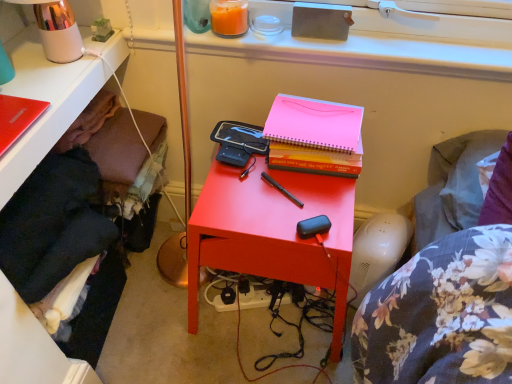
Identify the location of hardcover book at center. The width and height of the screenshot is (512, 384). (314, 123).

This screenshot has width=512, height=384. Describe the element at coordinates (52, 96) in the screenshot. I see `black fabric at lower left` at that location.

The height and width of the screenshot is (384, 512). Find the location of `black fabric at lower left`. black fabric at lower left is located at coordinates (52, 96).

At what (x,y) coordinates should I click in order to perform the action: click on orange wax candle at upper center. Please return your answer as a coordinate pair (x, y). Looking at the image, I should click on (229, 17).

What is the approximate height of matte red notebook at upper left?

The height of matte red notebook at upper left is 1.07 inches.

This screenshot has height=384, width=512. I want to click on hardcover book at center, so click(x=314, y=123).

Is matte red nightstand at center next to metallic pink table lamp at upper left?

No, matte red nightstand at center is not making contact with metallic pink table lamp at upper left.

Considering their positions, is matte red nightstand at center located in front of or behind metallic pink table lamp at upper left?

matte red nightstand at center is positioned farther from the viewer than metallic pink table lamp at upper left.

From a real-world perspective, is matte red nightstand at center physically above metallic pink table lamp at upper left?

No, from a real-world perspective, matte red nightstand at center is not over metallic pink table lamp at upper left

Is point (342, 178) positioned in front of point (65, 21)?

No.

Is point (1, 129) positioned after point (50, 13)?

No, (1, 129) is closer to viewer.

Can you confirm if matte red notebook at upper left is taller than metallic pink table lamp at upper left?

Incorrect, the height of matte red notebook at upper left is not larger of that of metallic pink table lamp at upper left.

Are matte red notebook at upper left and metallic pink table lamp at upper left making contact?

matte red notebook at upper left and metallic pink table lamp at upper left are not in contact.

Is matte red notebook at upper left at the right side of metallic pink table lamp at upper left?

No, matte red notebook at upper left is not to the right of metallic pink table lamp at upper left.

In terms of height, does metallic pink table lamp at upper left look taller or shorter compared to black fabric at lower left?

metallic pink table lamp at upper left is shorter than black fabric at lower left.

Is metallic pink table lamp at upper left spatially inside black fabric at lower left, or outside of it?

metallic pink table lamp at upper left cannot be found inside black fabric at lower left.

Considering the relative sizes of metallic pink table lamp at upper left and black fabric at lower left in the image provided, is metallic pink table lamp at upper left wider than black fabric at lower left?

In fact, metallic pink table lamp at upper left might be narrower than black fabric at lower left.

Is black fabric at lower left not within matte red notebook at upper left?

black fabric at lower left is positioned outside matte red notebook at upper left.

Is point (10, 91) closer or farther from the camera than point (22, 111)?

Point (10, 91) appears to be farther away from the viewer than point (22, 111).

Considering their positions, is black fabric at lower left located in front of or behind matte red notebook at upper left?

In the image, black fabric at lower left appears behind matte red notebook at upper left.

Which of these two, black fabric at lower left or matte red notebook at upper left, is bigger?

black fabric at lower left.

From a real-world perspective, is orange wax candle at upper center above or below metallic pink table lamp at upper left?

From a real-world perspective, orange wax candle at upper center is physically below metallic pink table lamp at upper left.

Is orange wax candle at upper center beside metallic pink table lamp at upper left?

No, orange wax candle at upper center is not touching metallic pink table lamp at upper left.

Is orange wax candle at upper center shorter than metallic pink table lamp at upper left?

Correct, orange wax candle at upper center is not as tall as metallic pink table lamp at upper left.

Considering their positions, is orange wax candle at upper center located in front of or behind metallic pink table lamp at upper left?

In the image, orange wax candle at upper center appears behind metallic pink table lamp at upper left.

In the scene shown: From the image's perspective, between black fabric at lower left and hardcover book at center, which one is located above?

From the image's view, hardcover book at center is above.

From a real-world perspective, who is located higher, black fabric at lower left or hardcover book at center?

In real-world perspective, hardcover book at center is above.

In the scene shown: Does black fabric at lower left turn towards hardcover book at center?

No, black fabric at lower left is not aimed at hardcover book at center.

Is black fabric at lower left to the left of hardcover book at center from the viewer's perspective?

Indeed, black fabric at lower left is positioned on the left side of hardcover book at center.

Is orange wax candle at upper center thinner than black fabric at lower left?

Yes, orange wax candle at upper center is thinner than black fabric at lower left.

From the image's perspective, is orange wax candle at upper center positioned above or below black fabric at lower left?

From the image's perspective, orange wax candle at upper center appears above black fabric at lower left.

Is orange wax candle at upper center located outside black fabric at lower left?

Indeed, orange wax candle at upper center is completely outside black fabric at lower left.

You are a GUI agent. You are given a task and a screenshot of the screen. Output one action in this format:
    pyautogui.click(x=<x>, y=<y>)
    Task: Click on the nightstand on the right side of metallic pink table lamp at upper left
    
    Given the screenshot: What is the action you would take?
    pyautogui.click(x=272, y=233)

In the image, there is a metallic pink table lamp at upper left. Where is `notebook below it (from the image's perspective)`? notebook below it (from the image's perspective) is located at coordinates (17, 118).

From the image, which object appears to be nearer to matte red notebook at upper left, orange wax candle at upper center or matte red nightstand at center?

orange wax candle at upper center is positioned closer to the anchor matte red notebook at upper left.

Considering their positions, is hardcover book at center positioned closer to orange wax candle at upper center than metallic pink table lamp at upper left?

Based on the image, hardcover book at center appears to be nearer to orange wax candle at upper center.

Looking at the image, which one is located closer to matte red notebook at upper left, metallic pink table lamp at upper left or orange wax candle at upper center?

The object closer to matte red notebook at upper left is metallic pink table lamp at upper left.

Based on the photo, estimate the real-world distances between objects in this image. Which object is closer to orange wax candle at upper center, matte red nightstand at center or matte red notebook at upper left?

matte red notebook at upper left is closer to orange wax candle at upper center.

Looking at the image, which one is located closer to hardcover book at center, orange wax candle at upper center or metallic pink table lamp at upper left?

Among the two, orange wax candle at upper center is located nearer to hardcover book at center.

Estimate the real-world distances between objects in this image. Which object is closer to matte red nightstand at center, orange wax candle at upper center or hardcover book at center?

The object closer to matte red nightstand at center is hardcover book at center.

Estimate the real-world distances between objects in this image. Which object is closer to matte red nightstand at center, matte red notebook at upper left or orange wax candle at upper center?

Among the two, orange wax candle at upper center is located nearer to matte red nightstand at center.

In the scene shown: Based on their spatial positions, is matte red nightstand at center or metallic pink table lamp at upper left closer to matte red notebook at upper left?

Among the two, metallic pink table lamp at upper left is located nearer to matte red notebook at upper left.

The image size is (512, 384). Find the location of `desk located between matte red notebook at upper left and matte red nightstand at center in the left-right direction`. desk located between matte red notebook at upper left and matte red nightstand at center in the left-right direction is located at coordinates (52, 96).

The width and height of the screenshot is (512, 384). Identify the location of notebook between metallic pink table lamp at upper left and black fabric at lower left in the vertical direction. (17, 118).

Identify the location of table lamp situated between matte red notebook at upper left and orange wax candle at upper center from left to right. (56, 29).

The image size is (512, 384). I want to click on nightstand located between matte red notebook at upper left and hardcover book at center in the left-right direction, so click(x=272, y=233).